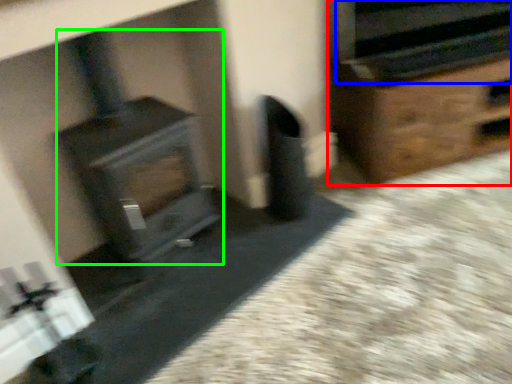
Question: Which object is the closest to the furniture (highlighted by a red box)? Choose among these: stereo (highlighted by a blue box) or wood burning stove (highlighted by a green box).

Choices:
 (A) stereo
 (B) wood burning stove

Answer: (A)